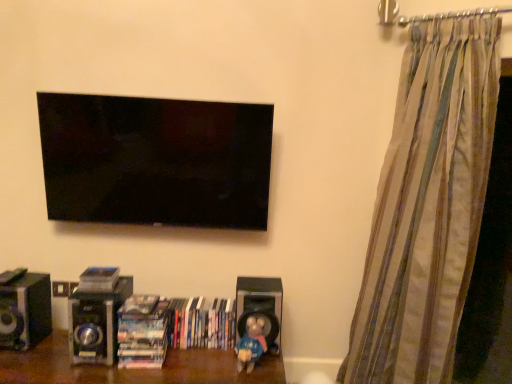
Question: Is matte plastic book at lower center, which is the 1th book in left-to-right order, to the left of black glossy speaker at lower left, the third speaker viewed from the right, from the viewer's perspective?

Choices:
 (A) no
 (B) yes

Answer: (A)

Question: Is matte plastic book at lower center, which is the 1th book in left-to-right order, to the right of black glossy speaker at lower left, the third speaker viewed from the right, from the viewer's perspective?

Choices:
 (A) no
 (B) yes

Answer: (B)

Question: Is the position of matte plastic book at lower center, the third book viewed from the right, less distant than that of black glossy speaker at lower left, the third speaker viewed from the right?

Choices:
 (A) yes
 (B) no

Answer: (B)

Question: Can black glossy speaker at lower left, the third speaker viewed from the right, be found inside matte plastic book at lower center, which is the 1th book in left-to-right order?

Choices:
 (A) no
 (B) yes

Answer: (A)

Question: Considering the positions of point [270, 292] and point [248, 329], is point [270, 292] closer or farther from the camera than point [248, 329]?

Choices:
 (A) closer
 (B) farther

Answer: (B)

Question: From the image's perspective, is black matte speaker at lower center, which is the 1th speaker in right-to-left order, located above or below blue matte toy at lower center?

Choices:
 (A) below
 (B) above

Answer: (B)

Question: Relative to blue matte toy at lower center, is black matte speaker at lower center, the 3th speaker when ordered from left to right, in front or behind?

Choices:
 (A) front
 (B) behind

Answer: (B)

Question: Considering the relative positions of black matte speaker at lower center, the 3th speaker when ordered from left to right, and blue matte toy at lower center in the image provided, is black matte speaker at lower center, the 3th speaker when ordered from left to right, to the left or to the right of blue matte toy at lower center?

Choices:
 (A) left
 (B) right

Answer: (B)

Question: Relative to black glossy speaker at lower left, which ranks as the 1th speaker in left-to-right order, is wooden shelf at lower center in front or behind?

Choices:
 (A) behind
 (B) front

Answer: (B)

Question: From a real-world perspective, is wooden shelf at lower center positioned above or below black glossy speaker at lower left, the third speaker viewed from the right?

Choices:
 (A) below
 (B) above

Answer: (A)

Question: Does point (52, 370) appear closer or farther from the camera than point (36, 321)?

Choices:
 (A) closer
 (B) farther

Answer: (A)

Question: Would you say wooden shelf at lower center is inside or outside black glossy speaker at lower left, which ranks as the 1th speaker in left-to-right order?

Choices:
 (A) inside
 (B) outside

Answer: (B)

Question: Considering their positions, is black matte speaker at lower center, the 3th speaker when ordered from left to right, located in front of or behind matte plastic book at lower center, the third book viewed from the right?

Choices:
 (A) behind
 (B) front

Answer: (A)

Question: Considering the positions of point (278, 279) and point (96, 281), is point (278, 279) closer or farther from the camera than point (96, 281)?

Choices:
 (A) closer
 (B) farther

Answer: (B)